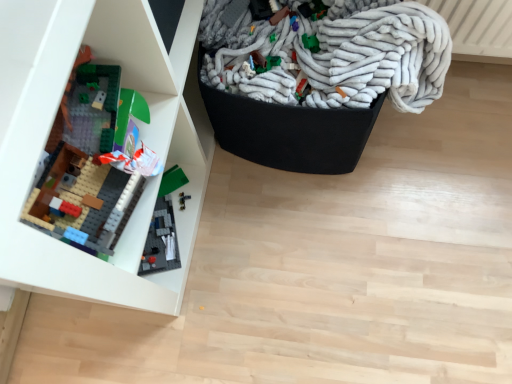
Question: Is white fuzzy blanket at upper right at the right side of matte plastic lego set at left?

Choices:
 (A) yes
 (B) no

Answer: (A)

Question: Is white fuzzy blanket at upper right directly adjacent to matte plastic lego set at left?

Choices:
 (A) no
 (B) yes

Answer: (A)

Question: Is the position of white fuzzy blanket at upper right less distant than that of matte plastic lego set at left?

Choices:
 (A) no
 (B) yes

Answer: (A)

Question: Does white fuzzy blanket at upper right have a larger size compared to matte plastic lego set at left?

Choices:
 (A) no
 (B) yes

Answer: (A)

Question: Is white fuzzy blanket at upper right wider than matte plastic lego set at left?

Choices:
 (A) yes
 (B) no

Answer: (A)

Question: Is matte plastic lego set at left surrounded by white fuzzy blanket at upper right?

Choices:
 (A) yes
 (B) no

Answer: (B)

Question: From a real-world perspective, is matte plastic lego set at left physically below white fuzzy blanket at upper right?

Choices:
 (A) yes
 (B) no

Answer: (B)

Question: Considering the relative positions of matte plastic lego set at left and white fuzzy blanket at upper right in the image provided, is matte plastic lego set at left to the right of white fuzzy blanket at upper right from the viewer's perspective?

Choices:
 (A) yes
 (B) no

Answer: (B)

Question: Are matte plastic lego set at left and white fuzzy blanket at upper right far apart?

Choices:
 (A) yes
 (B) no

Answer: (B)

Question: Is the position of matte plastic lego set at left more distant than that of white fuzzy blanket at upper right?

Choices:
 (A) no
 (B) yes

Answer: (A)

Question: Considering the relative positions of matte plastic lego set at left and white fuzzy blanket at upper right in the image provided, is matte plastic lego set at left in front of white fuzzy blanket at upper right?

Choices:
 (A) yes
 (B) no

Answer: (A)

Question: From the image's perspective, does matte plastic lego set at left appear higher than white fuzzy blanket at upper right?

Choices:
 (A) no
 (B) yes

Answer: (A)

Question: Looking at their shapes, would you say matte plastic lego set at left is wider or thinner than white fuzzy blanket at upper right?

Choices:
 (A) wide
 (B) thin

Answer: (B)